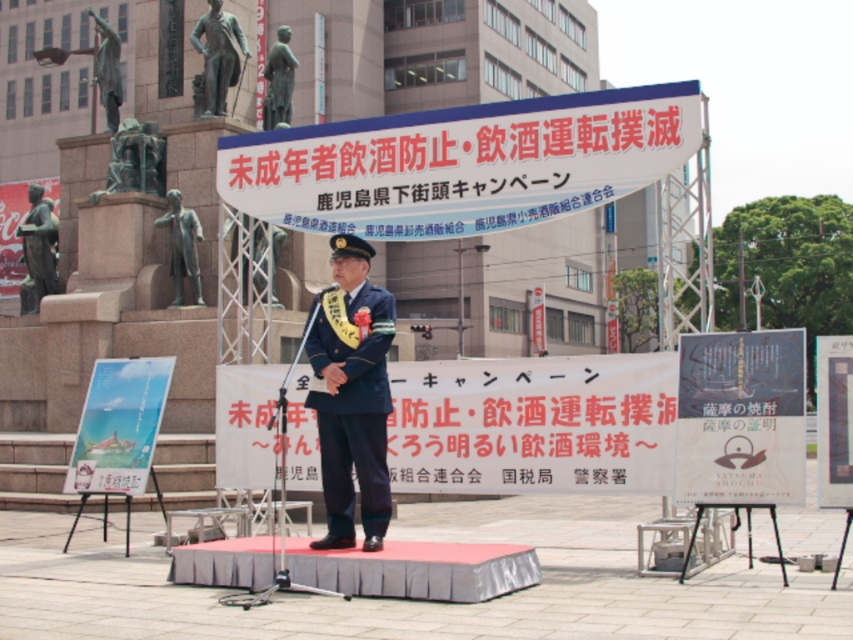
Question: Does white paper sign at upper center come in front of white paper banner at center?

Choices:
 (A) no
 (B) yes

Answer: (A)

Question: Which of the following is the farthest from the observer?

Choices:
 (A) matte bronze statue at left
 (B) white plastic sign at right
 (C) dark blue fabric uniform at center
 (D) white paper sign at upper center

Answer: (A)

Question: Which object is farther from the camera taking this photo?

Choices:
 (A) dark blue fabric uniform at center
 (B) white paper sign at upper center

Answer: (B)

Question: Which object is positioned farthest from the white paper banner at center?

Choices:
 (A) matte bronze statue at left
 (B) white plastic sign at right
 (C) dark blue fabric uniform at center
 (D) white paper sign at upper center

Answer: (A)

Question: Is dark blue fabric uniform at center further to the viewer compared to matte bronze statue at left?

Choices:
 (A) no
 (B) yes

Answer: (A)

Question: Is white paper sign at upper center bigger than white plastic sign at right?

Choices:
 (A) no
 (B) yes

Answer: (B)